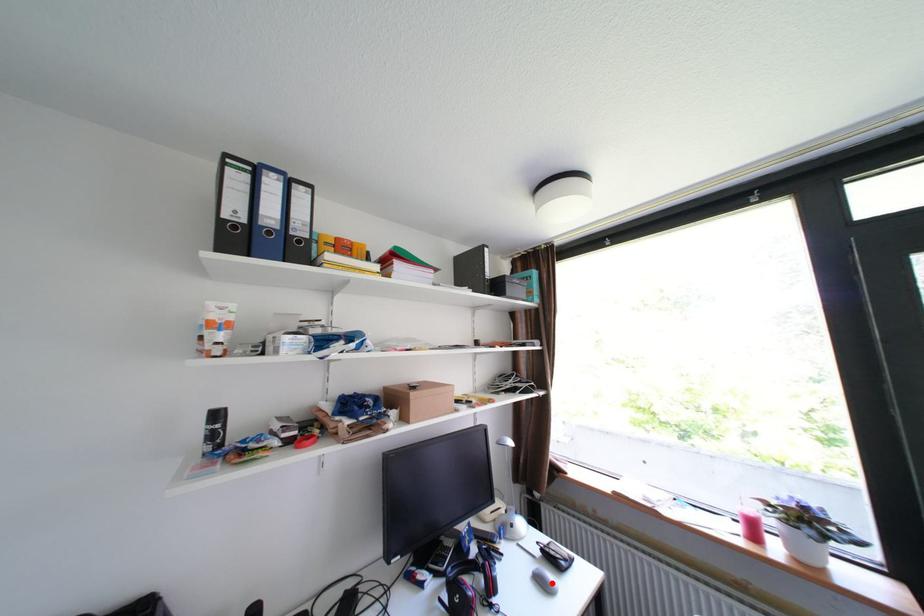
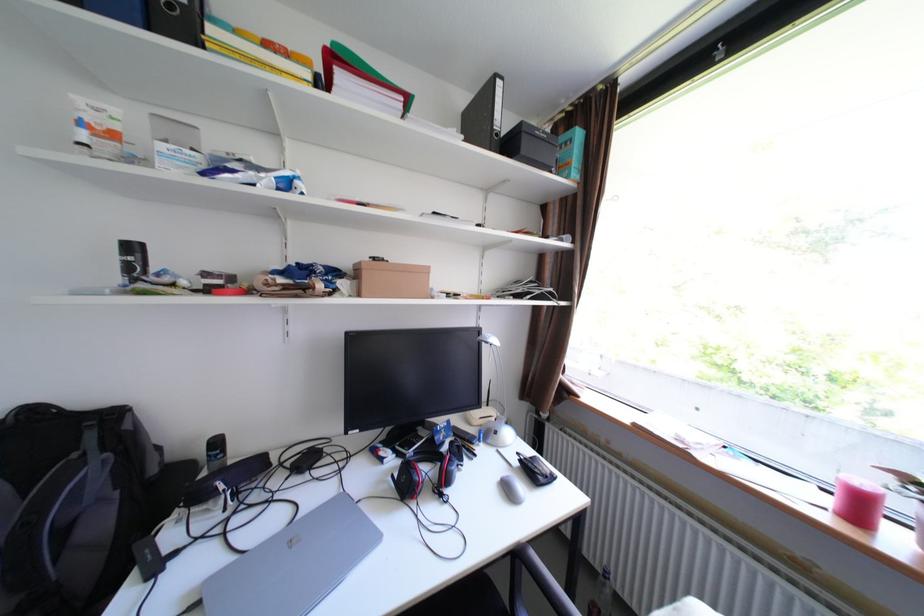
In the second image, find the point that corresponds to the highlighted location in the first image.

(517, 490)